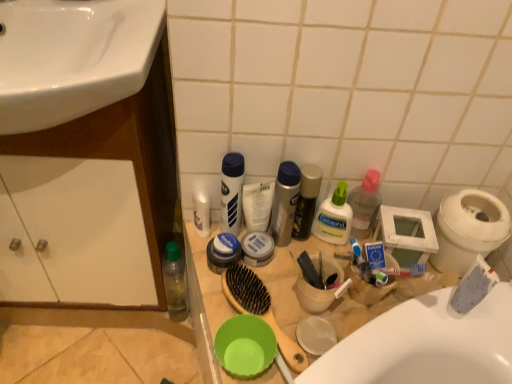
I want to click on free location to the right of blue rubber balm at center, marked as the 2th toiletry in a left-to-right arrangement, so click(x=294, y=278).